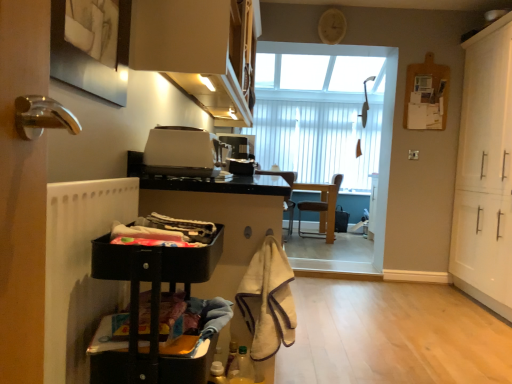
Question: From a real-world perspective, is brown leather chair at center, placed as the 1th chair when sorted from left to right, positioned under white matte radiator at left based on gravity?

Choices:
 (A) yes
 (B) no

Answer: (A)

Question: Considering the relative positions of brown leather chair at center, placed as the 1th chair when sorted from left to right, and white matte radiator at left in the image provided, is brown leather chair at center, placed as the 1th chair when sorted from left to right, behind white matte radiator at left?

Choices:
 (A) yes
 (B) no

Answer: (A)

Question: Can you confirm if brown leather chair at center, placed as the 1th chair when sorted from left to right, is thinner than white matte radiator at left?

Choices:
 (A) no
 (B) yes

Answer: (A)

Question: From the image's perspective, is brown leather chair at center, placed as the 1th chair when sorted from left to right, beneath white matte radiator at left?

Choices:
 (A) yes
 (B) no

Answer: (B)

Question: Is brown leather chair at center, placed as the 1th chair when sorted from left to right, turned away from white matte radiator at left?

Choices:
 (A) no
 (B) yes

Answer: (B)

Question: From a real-world perspective, is brown leather chair at center, placed as the 1th chair when sorted from left to right, on white matte radiator at left?

Choices:
 (A) yes
 (B) no

Answer: (B)

Question: Is white matte cabinet at right, which ranks as the 1th cabinetry in right-to-left order, behind black plastic cart at lower left, arranged as the third cabinetry when viewed from the right?

Choices:
 (A) no
 (B) yes

Answer: (B)

Question: From the image's perspective, is white matte cabinet at right, the third cabinetry from the left, located beneath black plastic cart at lower left, positioned as the first cabinetry in left-to-right order?

Choices:
 (A) yes
 (B) no

Answer: (B)

Question: Can you confirm if white matte cabinet at right, which ranks as the 1th cabinetry in right-to-left order, is bigger than black plastic cart at lower left, positioned as the first cabinetry in left-to-right order?

Choices:
 (A) yes
 (B) no

Answer: (A)

Question: Does white matte cabinet at right, the third cabinetry from the left, have a lesser height compared to black plastic cart at lower left, positioned as the first cabinetry in left-to-right order?

Choices:
 (A) yes
 (B) no

Answer: (B)

Question: Considering the relative positions of white matte cabinet at right, which ranks as the 1th cabinetry in right-to-left order, and black plastic cart at lower left, arranged as the third cabinetry when viewed from the right, in the image provided, is white matte cabinet at right, which ranks as the 1th cabinetry in right-to-left order, in front of black plastic cart at lower left, arranged as the third cabinetry when viewed from the right,?

Choices:
 (A) yes
 (B) no

Answer: (B)

Question: Would you say black plastic cart at lower left, positioned as the first cabinetry in left-to-right order, is part of white matte cabinet at right, which ranks as the 1th cabinetry in right-to-left order,'s contents?

Choices:
 (A) no
 (B) yes

Answer: (A)

Question: From the image's perspective, is matte white cabinet at upper center, the 2th cabinetry positioned from the left, on white matte cabinet at right, which ranks as the 1th cabinetry in right-to-left order?

Choices:
 (A) yes
 (B) no

Answer: (A)